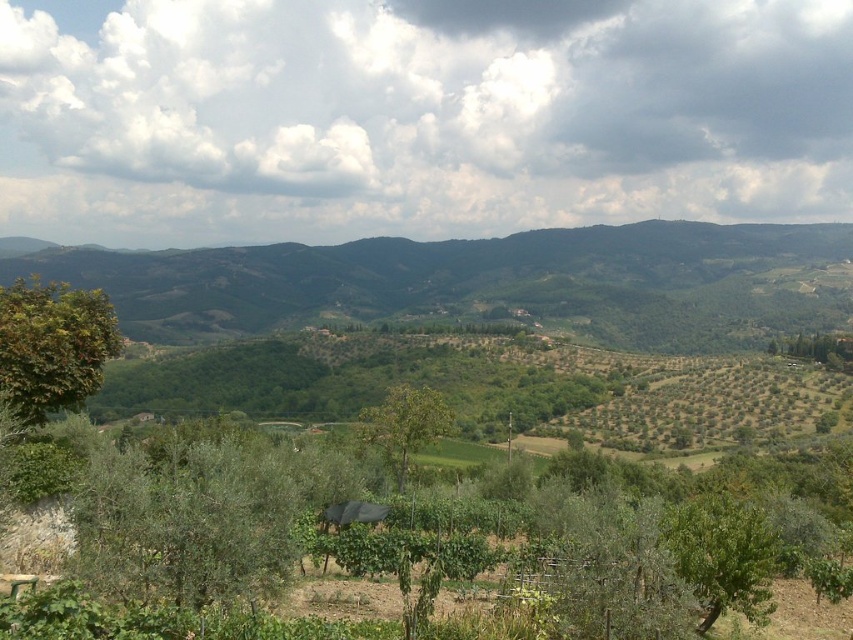
Measure the distance from green leafy tree at left to green leafy tree at lower right.

green leafy tree at left is 20.43 meters away from green leafy tree at lower right.

Between point (96, 307) and point (706, 540), which one is positioned in front?

Point (706, 540) is in front.

Find the location of a particular element. The image size is (853, 640). green leafy tree at left is located at coordinates (51, 346).

Is point (746, 275) positioned after point (70, 291)?

Yes, it is.

Is point (42, 262) closer to viewer compared to point (67, 292)?

That is False.

Does point (317, 264) come farther from viewer compared to point (57, 369)?

Yes, it is.

Identify the location of green leafy hillside at center. The height and width of the screenshot is (640, 853). (485, 282).

Who is higher up, green leafy tree at lower right or green leafy tree at center?

green leafy tree at lower right

Is point (694, 568) behind point (415, 396)?

No, (694, 568) is in front of (415, 396).

This screenshot has width=853, height=640. I want to click on green leafy tree at lower right, so click(x=723, y=556).